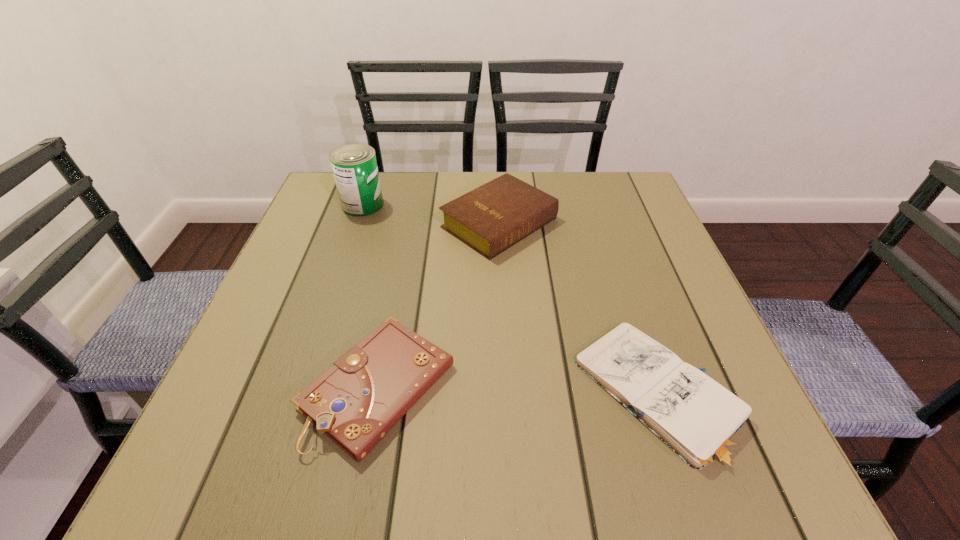
Locate an element on the screen. Image resolution: width=960 pixels, height=540 pixels. can is located at coordinates (354, 166).

Find the location of `the second tallest object`. the second tallest object is located at coordinates (490, 219).

In order to click on the taller notebook in this screenshot , I will do `click(355, 402)`.

Image resolution: width=960 pixels, height=540 pixels. I want to click on the third tallest object, so pyautogui.click(x=355, y=402).

The image size is (960, 540). Identify the location of the right notebook. 699,419.

In order to click on the shorter notebook in this screenshot , I will do `click(699, 419)`.

This screenshot has height=540, width=960. In order to click on vacant area located 0.300m on the front of the can in this screenshot , I will do `click(328, 306)`.

The height and width of the screenshot is (540, 960). What are the coordinates of `free space located on the front of the Bible` in the screenshot? It's located at (503, 287).

At what (x,y) coordinates should I click in order to perform the action: click on vacant region located on the back of the taller notebook. Please return your answer as a coordinate pair (x, y). This screenshot has height=540, width=960. Looking at the image, I should click on (397, 285).

Image resolution: width=960 pixels, height=540 pixels. I want to click on vacant position located on the left of the shorter notebook, so click(x=427, y=395).